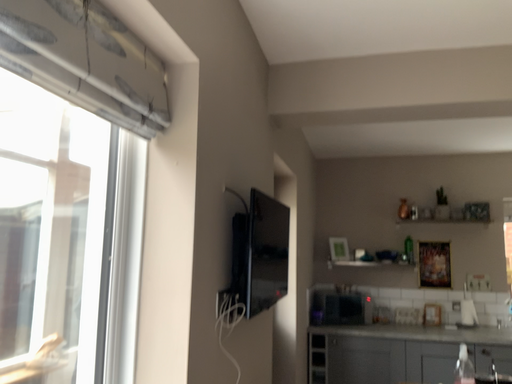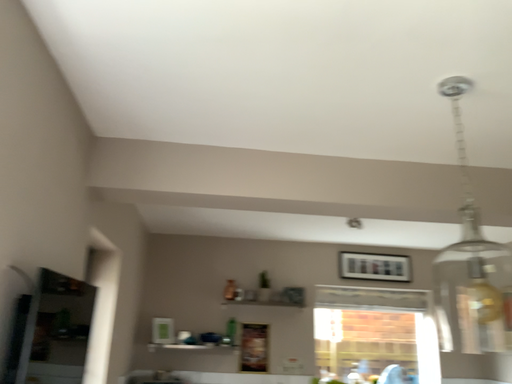
Question: How did the camera likely rotate when shooting the video?

Choices:
 (A) rotated upward
 (B) rotated downward

Answer: (A)